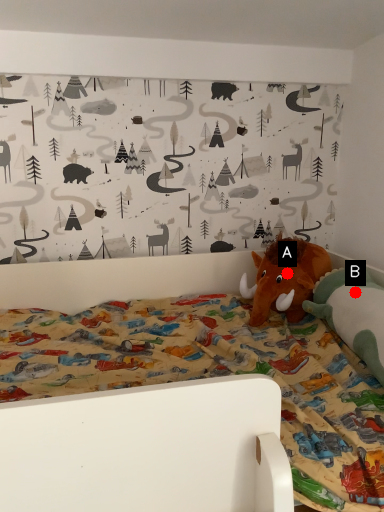
Question: Two points are circled on the image, labeled by A and B beside each circle. Which point is farther from the camera taking this photo?

Choices:
 (A) A is further
 (B) B is further

Answer: (A)